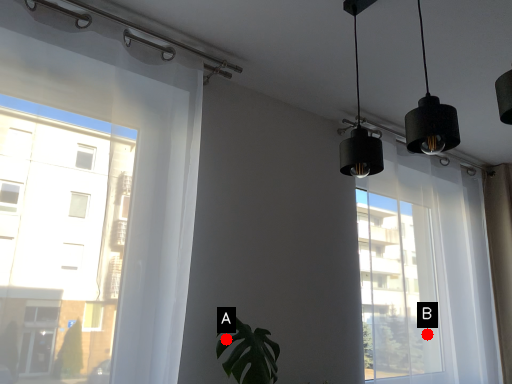
Question: Two points are circled on the image, labeled by A and B beside each circle. Which point is farther from the camera taking this photo?

Choices:
 (A) A is further
 (B) B is further

Answer: (B)